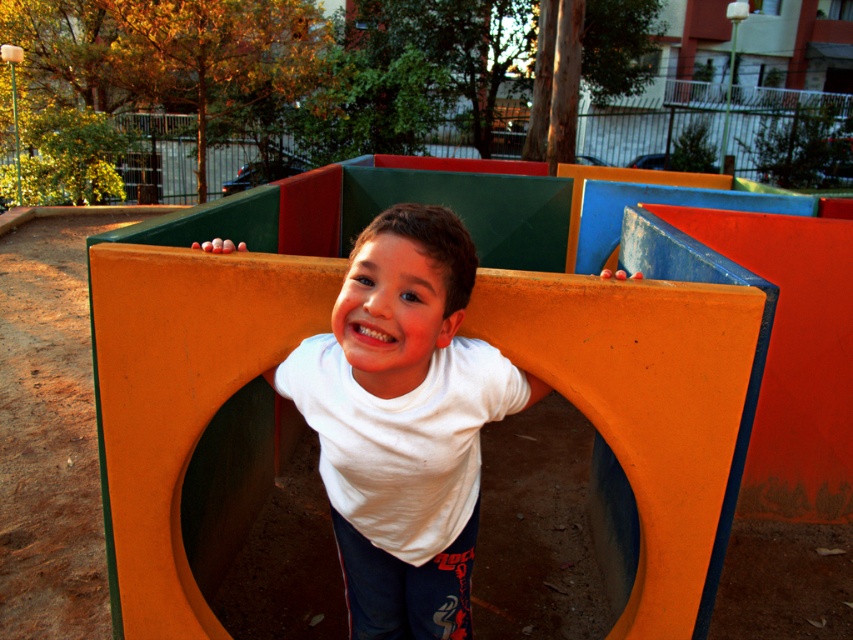
Question: Does orange matte plastic at center appear on the left side of white matte shirt at center?

Choices:
 (A) no
 (B) yes

Answer: (A)

Question: Which of the following is the farthest from the observer?

Choices:
 (A) (368, 442)
 (B) (364, 220)

Answer: (B)

Question: Is the position of orange matte plastic at center less distant than that of white matte shirt at center?

Choices:
 (A) no
 (B) yes

Answer: (A)

Question: Does orange matte plastic at center appear over white matte shirt at center?

Choices:
 (A) no
 (B) yes

Answer: (B)